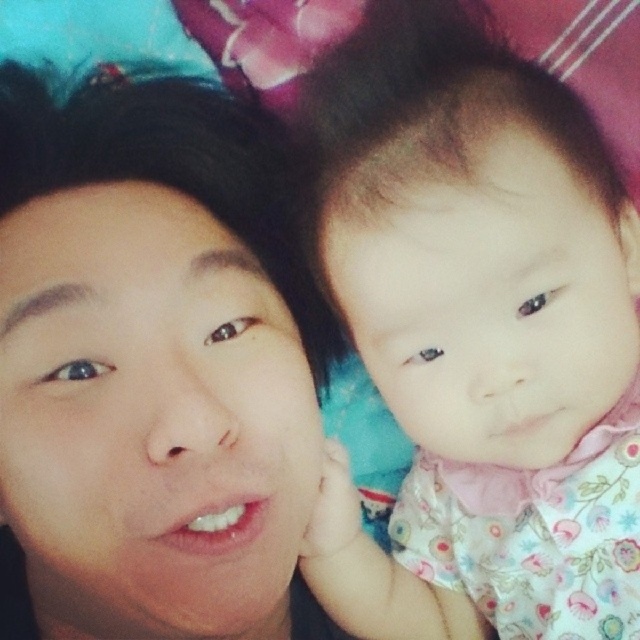
Question: Observing the image, what is the correct spatial positioning of fluffy pink dress at upper right in reference to smooth skin face at center?

Choices:
 (A) above
 (B) below

Answer: (A)

Question: Can you confirm if fluffy pink dress at upper right is thinner than smooth skin face at center?

Choices:
 (A) yes
 (B) no

Answer: (A)

Question: Where is fluffy pink dress at upper right located in relation to smooth skin face at center in the image?

Choices:
 (A) right
 (B) left

Answer: (A)

Question: Among these points, which one is nearest to the camera?

Choices:
 (A) (499, 326)
 (B) (211, 138)

Answer: (A)

Question: Which object appears closest to the camera in this image?

Choices:
 (A) smooth skin face at center
 (B) fluffy pink dress at upper right

Answer: (A)

Question: Which of the following is the closest to the observer?

Choices:
 (A) (570, 317)
 (B) (86, 385)

Answer: (B)